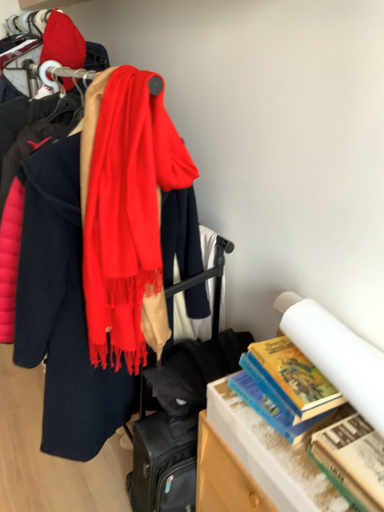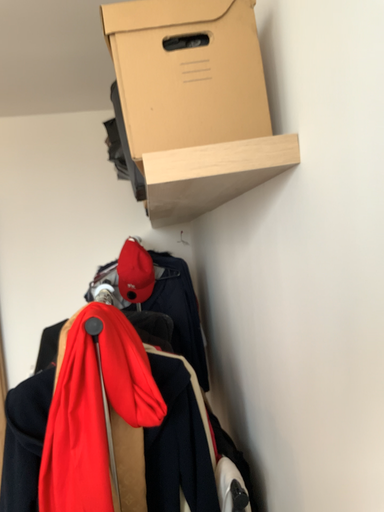
Question: Which way did the camera rotate in the video?

Choices:
 (A) rotated upward
 (B) rotated downward

Answer: (A)